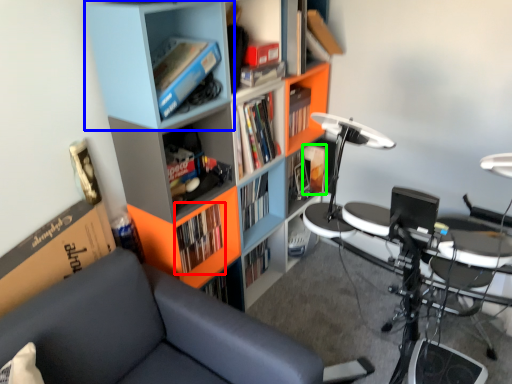
Question: Based on their relative distances, which object is farther from book (highlighted by a red box)? Choose from shelf (highlighted by a blue box) and book (highlighted by a green box).

Choices:
 (A) shelf
 (B) book

Answer: (B)